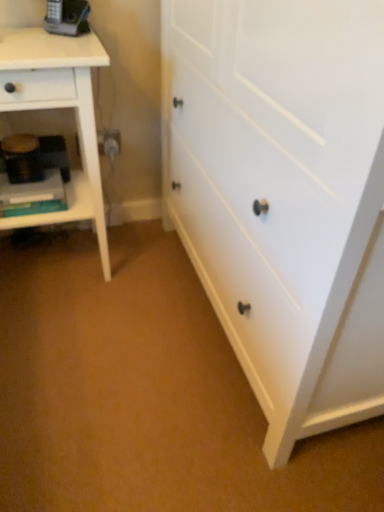
Locate an element on the screen. empty space that is in between white wood nightstand at left and white matte chest of drawers at center is located at coordinates (133, 326).